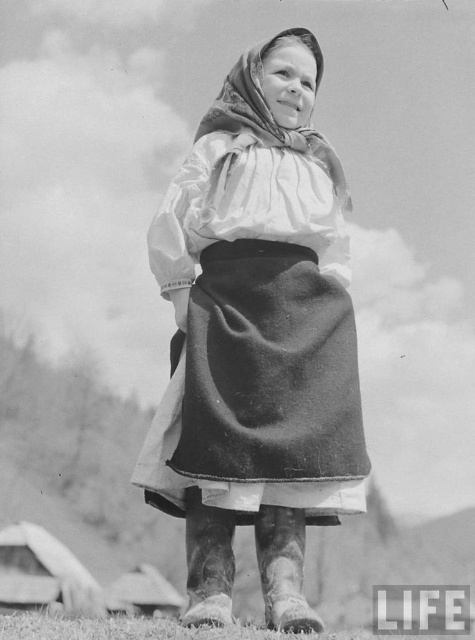
Consider the image. Based on the description of the girl wearing a white cotton blouse at center and a soft white scarf at center, which clothing item is taller?

The white cotton blouse at center is taller than the soft white scarf at center.